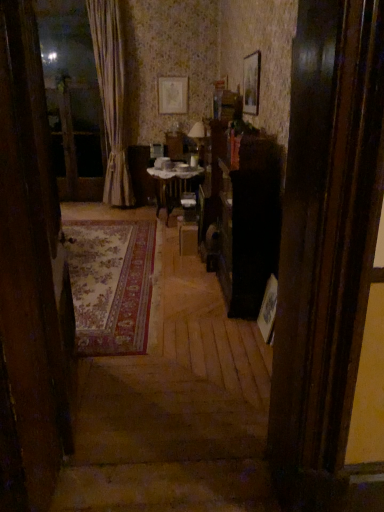
I want to click on vacant area to the right of carpeted rug at left, so click(x=165, y=388).